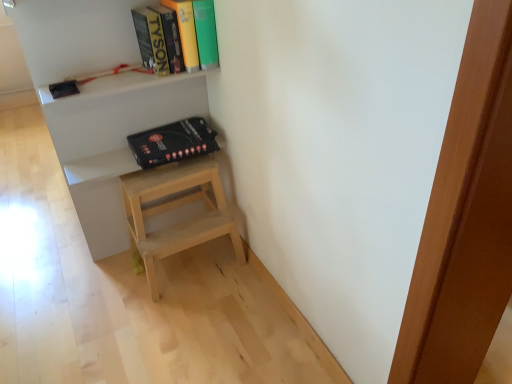
Question: Is hardcover book at upper center at the right side of black matte box at upper center?

Choices:
 (A) yes
 (B) no

Answer: (A)

Question: Is hardcover book at upper center positioned behind black matte box at upper center?

Choices:
 (A) yes
 (B) no

Answer: (B)

Question: From the image's perspective, is hardcover book at upper center below black matte box at upper center?

Choices:
 (A) no
 (B) yes

Answer: (A)

Question: Does hardcover book at upper center turn towards black matte box at upper center?

Choices:
 (A) no
 (B) yes

Answer: (A)

Question: Is hardcover book at upper center smaller than black matte box at upper center?

Choices:
 (A) no
 (B) yes

Answer: (A)

Question: Relative to white matte shelf at upper center, is black matte box at upper center in front or behind?

Choices:
 (A) front
 (B) behind

Answer: (B)

Question: Is black matte box at upper center taller or shorter than white matte shelf at upper center?

Choices:
 (A) short
 (B) tall

Answer: (A)

Question: Is black matte box at upper center situated inside white matte shelf at upper center or outside?

Choices:
 (A) inside
 (B) outside

Answer: (A)

Question: Is black matte box at upper center wider or thinner than white matte shelf at upper center?

Choices:
 (A) wide
 (B) thin

Answer: (A)

Question: Considering the positions of black matte box at upper center and hardcover book at upper center in the image, is black matte box at upper center taller or shorter than hardcover book at upper center?

Choices:
 (A) short
 (B) tall

Answer: (A)

Question: Which is correct: black matte box at upper center is inside hardcover book at upper center, or outside of it?

Choices:
 (A) outside
 (B) inside

Answer: (A)

Question: In the image, is black matte box at upper center on the left side or the right side of hardcover book at upper center?

Choices:
 (A) left
 (B) right

Answer: (A)

Question: From the image's perspective, relative to hardcover book at upper center, is black matte box at upper center above or below?

Choices:
 (A) below
 (B) above

Answer: (A)

Question: From their relative heights in the image, would you say white matte shelf at upper center is taller or shorter than black matte box at upper center?

Choices:
 (A) tall
 (B) short

Answer: (A)

Question: Is white matte shelf at upper center bigger or smaller than black matte box at upper center?

Choices:
 (A) small
 (B) big

Answer: (B)